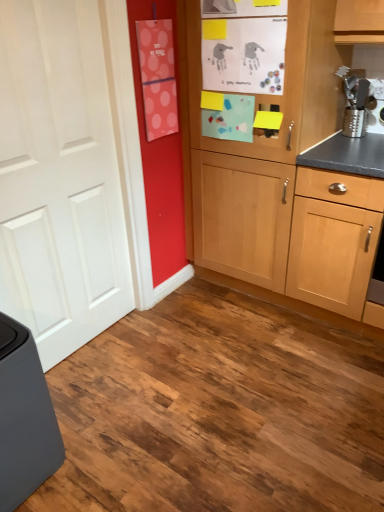
Image resolution: width=384 pixels, height=512 pixels. What are the coordinates of `vacant area that is situated to the right of white matte door at left` in the screenshot? It's located at (165, 351).